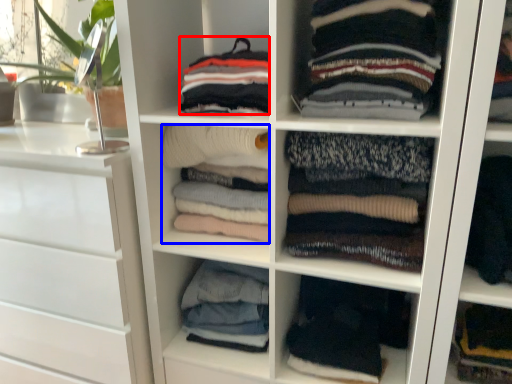
Question: Which object appears farthest to the camera in this image, clothing (highlighted by a red box) or clothing (highlighted by a blue box)?

Choices:
 (A) clothing
 (B) clothing

Answer: (B)